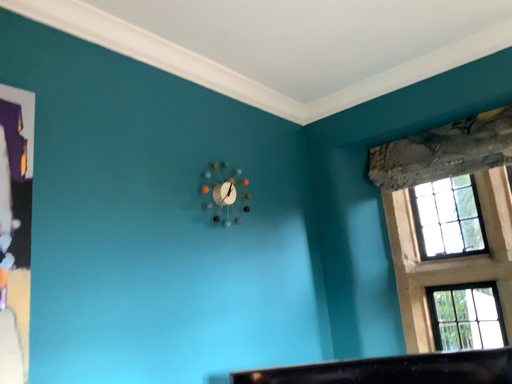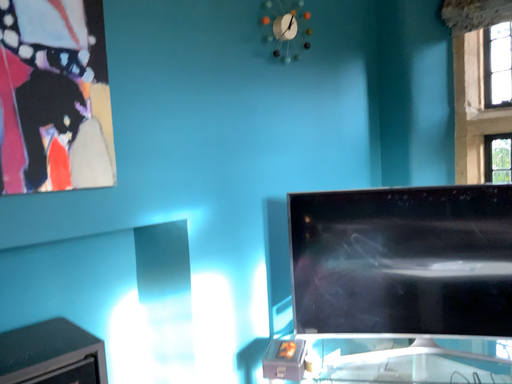
Question: Which way did the camera rotate in the video?

Choices:
 (A) rotated right
 (B) rotated left

Answer: (B)